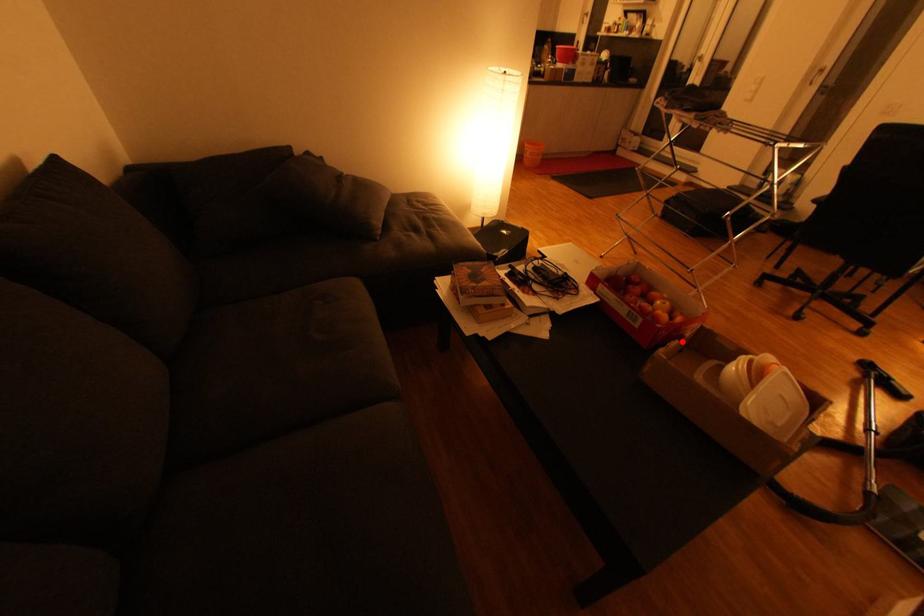
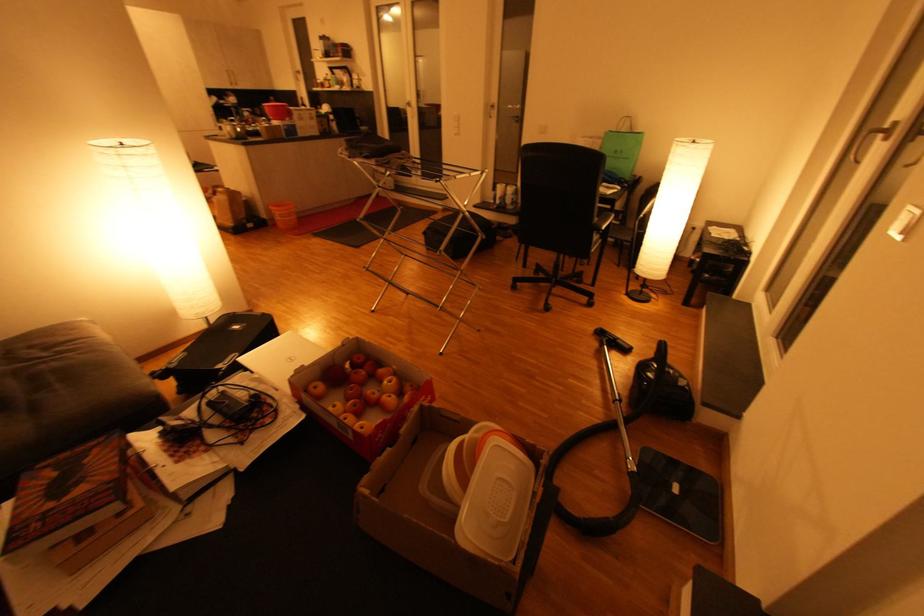
The point at the highlighted location is marked in the first image. Where is the corresponding point in the second image?

(394, 448)